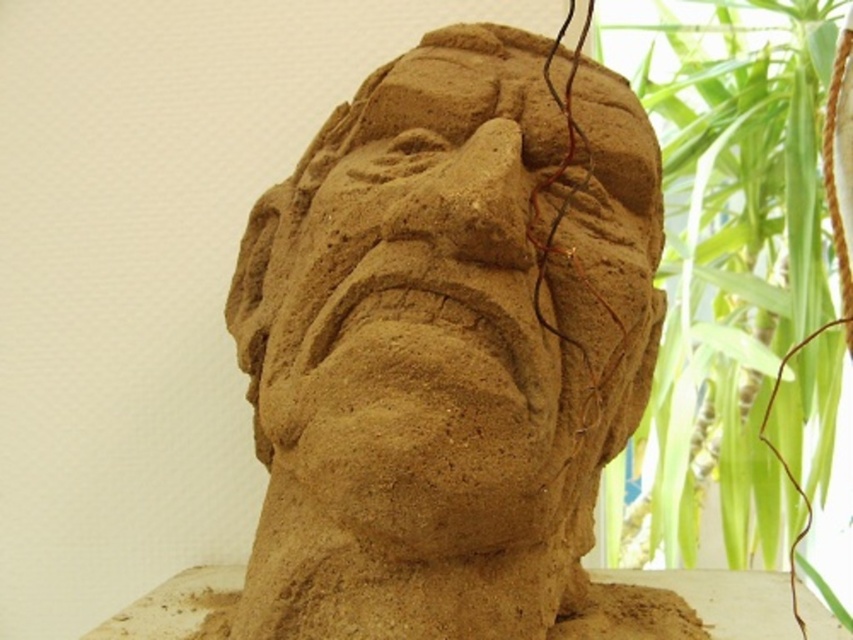
Question: Which of the following is the closest to the observer?

Choices:
 (A) brown sand sculpture at center
 (B) green leafy plant at upper right

Answer: (A)

Question: Where is brown sand sculpture at center located in relation to green leafy plant at upper right in the image?

Choices:
 (A) below
 (B) above

Answer: (A)

Question: Observing the image, what is the correct spatial positioning of brown sand sculpture at center in reference to green leafy plant at upper right?

Choices:
 (A) left
 (B) right

Answer: (A)

Question: Which point is farther to the camera?

Choices:
 (A) brown sand sculpture at center
 (B) green leafy plant at upper right

Answer: (B)

Question: Can you confirm if brown sand sculpture at center is bigger than green leafy plant at upper right?

Choices:
 (A) yes
 (B) no

Answer: (A)